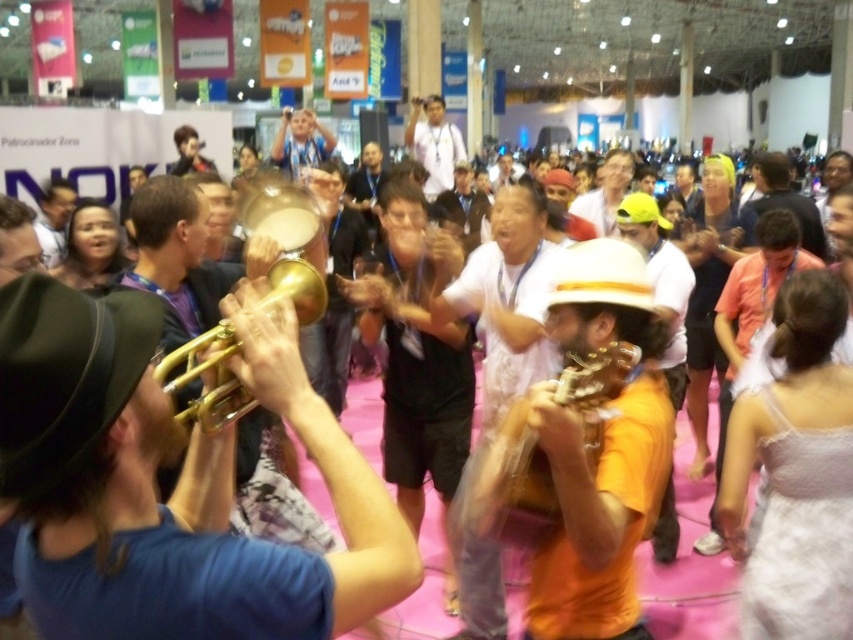
You are a photographer holding a camera and want to capture a closeup shot of the shiny gold trumpet at center without moving the camera. Is the trumpet within the standard 1 meter minimum focusing distance of most cameras?

The shiny gold trumpet at center and camera are 88.81 centimeters apart from each other. Since 88.81 cm is less than 1 meter, the trumpet is within the standard 1 meter minimum focusing distance, so you can capture the closeup shot.

You are a photographer at the event and want to capture both the shiny gold trumpet at center and the white cotton shirt at center in a single photo. Which object should you focus on first to ensure both are in frame?

You should focus on the shiny gold trumpet at center first because it is smaller in size compared to the white cotton shirt at center, so positioning it properly will help ensure both fit within the frame.

You are standing in the middle of the event hall and see two points in the crowd. The first point is at coordinate point (229, 314) and the second is at point (802, 240). Which point is closer to you?

Point (229, 314) is closer to the viewer than point (802, 240).